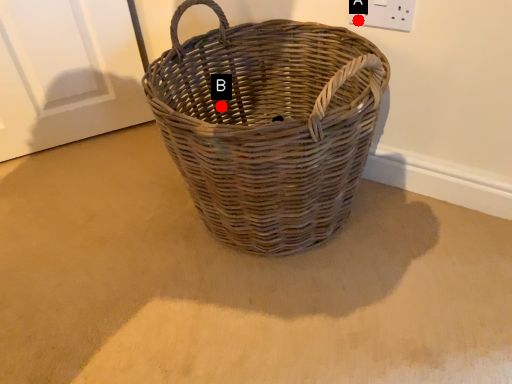
Question: Two points are circled on the image, labeled by A and B beside each circle. Which point is closer to the camera?

Choices:
 (A) A is closer
 (B) B is closer

Answer: (A)